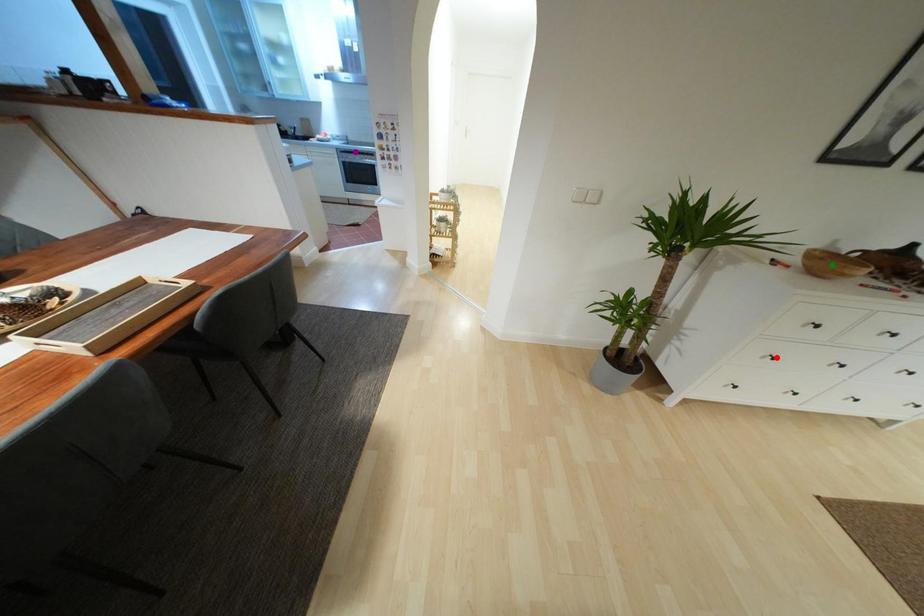
Order these from nearest to farthest:
- green point
- red point
- purple point

purple point < red point < green point